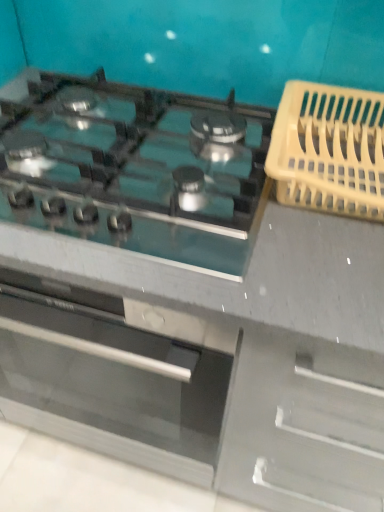
What is the approximate width of yellow plastic basket at right?

14.82 inches.

This screenshot has width=384, height=512. What do you see at coordinates (329, 150) in the screenshot? I see `yellow plastic basket at right` at bounding box center [329, 150].

In order to click on yellow plastic basket at right in this screenshot , I will do `click(329, 150)`.

What do you see at coordinates (135, 168) in the screenshot?
I see `satin silver gas stove at center` at bounding box center [135, 168].

Locate an element on the screen. This screenshot has width=384, height=512. satin silver gas stove at center is located at coordinates (135, 168).

Measure the distance between point (87, 194) and camera.

Point (87, 194) is 26.77 inches away from camera.

The height and width of the screenshot is (512, 384). I want to click on yellow plastic basket at right, so click(329, 150).

Does yellow plastic basket at right appear on the right side of satin silver gas stove at center?

Indeed, yellow plastic basket at right is positioned on the right side of satin silver gas stove at center.

Consider the image. Is yellow plastic basket at right positioned in front of satin silver gas stove at center?

No, it is not.

Does point (293, 106) appear closer or farther from the camera than point (144, 210)?

Point (293, 106).

From the image's perspective, is yellow plastic basket at right on top of satin silver gas stove at center?

Yes.

From a real-world perspective, is yellow plastic basket at right on top of satin silver gas stove at center?

Yes.

Between yellow plastic basket at right and satin silver gas stove at center, which one has larger width?

satin silver gas stove at center.

Between yellow plastic basket at right and satin silver gas stove at center, which one has more height?

yellow plastic basket at right is taller.

In terms of size, does yellow plastic basket at right appear bigger or smaller than satin silver gas stove at center?

Considering their sizes, yellow plastic basket at right takes up less space than satin silver gas stove at center.

Is satin silver gas stove at center a part of yellow plastic basket at right?

No, satin silver gas stove at center is not a part of yellow plastic basket at right.

Consider the image. Is yellow plastic basket at right beside satin silver gas stove at center?

yellow plastic basket at right is not next to satin silver gas stove at center, and they're not touching.

Is yellow plastic basket at right looking in the opposite direction of satin silver gas stove at center?

No, satin silver gas stove at center is not at the back of yellow plastic basket at right.

How different are the orientations of yellow plastic basket at right and satin silver gas stove at center in degrees?

They differ by 0.000282 degrees in their facing directions.

Where is `basket that appears behind the satin silver gas stove at center`? basket that appears behind the satin silver gas stove at center is located at coordinates (x=329, y=150).

Based on their positions, is satin silver gas stove at center located to the left or right of yellow plastic basket at right?

In the image, satin silver gas stove at center appears on the left side of yellow plastic basket at right.

Which object is further away from the camera, satin silver gas stove at center or yellow plastic basket at right?

yellow plastic basket at right is behind.

Is point (162, 91) positioned in front of point (307, 143)?

That is False.

From the image's perspective, would you say satin silver gas stove at center is shown under yellow plastic basket at right?

Yes, from the image's perspective, satin silver gas stove at center is beneath yellow plastic basket at right.

From a real-world perspective, who is located lower, satin silver gas stove at center or yellow plastic basket at right?

satin silver gas stove at center, from a real-world perspective.

Which object is thinner, satin silver gas stove at center or yellow plastic basket at right?

Thinner between the two is yellow plastic basket at right.

Considering the relative sizes of satin silver gas stove at center and yellow plastic basket at right in the image provided, is satin silver gas stove at center taller than yellow plastic basket at right?

Incorrect, the height of satin silver gas stove at center is not larger of that of yellow plastic basket at right.

In the scene shown: Considering the sizes of objects satin silver gas stove at center and yellow plastic basket at right in the image provided, who is bigger, satin silver gas stove at center or yellow plastic basket at right?

satin silver gas stove at center.

Is satin silver gas stove at center outside of yellow plastic basket at right?

satin silver gas stove at center is positioned outside yellow plastic basket at right.

Is satin silver gas stove at center positioned far away from yellow plastic basket at right?

satin silver gas stove at center is actually quite close to yellow plastic basket at right.

Is satin silver gas stove at center positioned with its back to yellow plastic basket at right?

No, satin silver gas stove at center is not facing away from yellow plastic basket at right.

How much distance is there between satin silver gas stove at center and yellow plastic basket at right?

satin silver gas stove at center and yellow plastic basket at right are 8.01 inches apart from each other.

What are the coordinates of `basket above the satin silver gas stove at center (from the image's perspective)` in the screenshot? It's located at (329, 150).

This screenshot has height=512, width=384. I want to click on gas stove below the yellow plastic basket at right (from the image's perspective), so click(x=135, y=168).

Where is `basket positioned vertically above the satin silver gas stove at center (from a real-world perspective)`? This screenshot has height=512, width=384. basket positioned vertically above the satin silver gas stove at center (from a real-world perspective) is located at coordinates (329, 150).